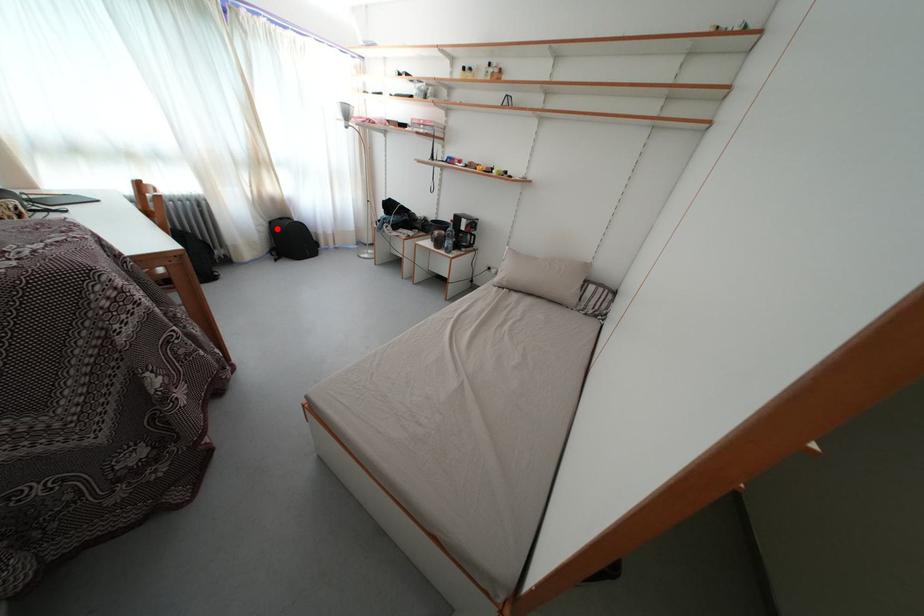
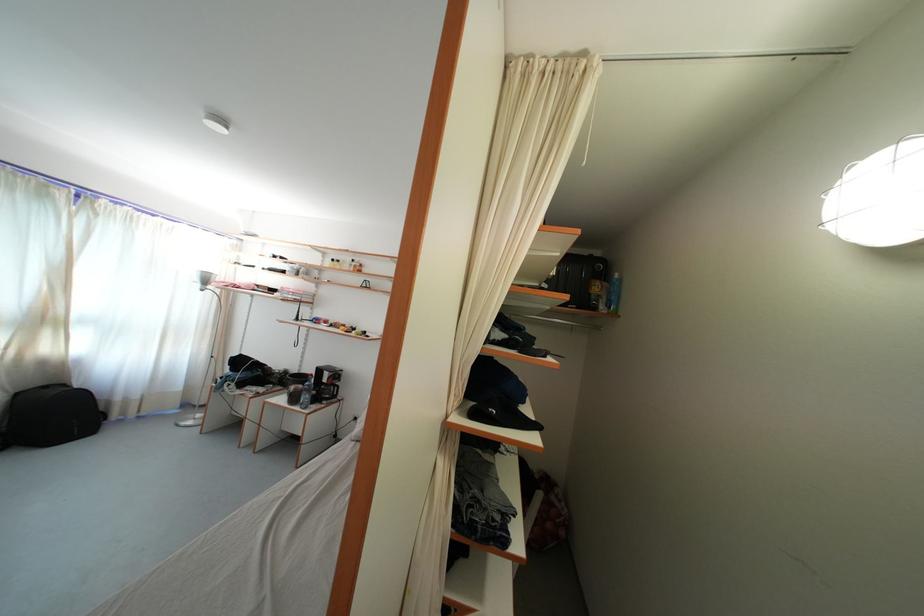
Locate, in the second image, the point that corresponds to the highlighted location in the first image.

(23, 400)